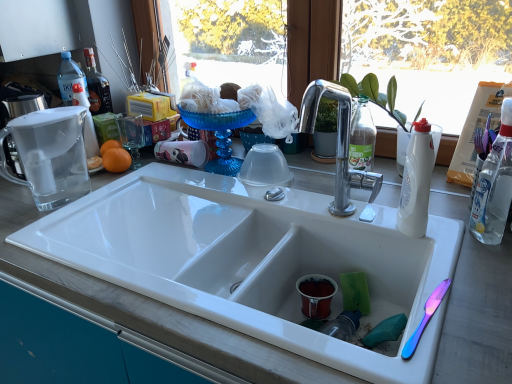
What is the approximate height of orangesmoothfruit at left?

3.16 inches.

You are a GUI agent. You are given a task and a screenshot of the screen. Output one action in this format:
    pyautogui.click(x=<x>, y=<y>)
    Task: Click on the green sponge at sink bottom
    
    Given the screenshot: What is the action you would take?
    pyautogui.click(x=355, y=292)

At what (x,y) coordinates should I click in order to perform the action: click on clear plastic bottle at upper left, arranged as the 3th bottle when viewed from the right. Please return your answer as a coordinate pair (x, y). Looking at the image, I should click on (77, 98).

Describe the element at coordinates (254, 260) in the screenshot. I see `white ceramic sink at center` at that location.

What do you see at coordinates (183, 152) in the screenshot?
I see `matte white coffee cup at center, marked as the second coffee cup in a right-to-left arrangement` at bounding box center [183, 152].

At what (x,y) coordinates should I click in order to perform the action: click on matte ceramic cup at sink bottom, which is counted as the second coffee cup, starting from the top. Please return your answer as a coordinate pair (x, y). Looking at the image, I should click on (316, 295).

Locate an element on the screen. clear glass pitcher at upper left is located at coordinates (50, 155).

Measure the distance between point [80,167] and camera.

A distance of 3.74 feet exists between point [80,167] and camera.

At what (x,y) coordinates should I click in order to perform the action: click on white plastic bottle at right, which appears as the 2th bottle when viewed from the back. Please return your answer as a coordinate pair (x, y). Looking at the image, I should click on (416, 181).

Is white plastic bottle at right, which is counted as the second bottle, starting from the left, turned away from white plastic bottle at right, the first bottle in the right-to-left sequence?

No, white plastic bottle at right, the first bottle in the right-to-left sequence, is not at the back of white plastic bottle at right, which is counted as the second bottle, starting from the left.

From the image's perspective, is white plastic bottle at right, acting as the 2th bottle starting from the front, located beneath white plastic bottle at right, the first bottle in the right-to-left sequence?

Correct, white plastic bottle at right, acting as the 2th bottle starting from the front, appears lower than white plastic bottle at right, the first bottle in the right-to-left sequence, in the image.

Can you confirm if white plastic bottle at right, which appears as the 2th bottle when viewed from the back, is positioned to the right of white plastic bottle at right, the 3th bottle in the back-to-front sequence?

No.

From a real-world perspective, who is located lower, white plastic bottle at right, which is counted as the second bottle, starting from the left, or white plastic bottle at right, the first bottle in the front-to-back sequence?

white plastic bottle at right, which is counted as the second bottle, starting from the left.

What are the coordinates of `the 2nd coffee cup directly above the green sponge at sink bottom (from a real-world perspective)` in the screenshot? It's located at (183, 152).

Can you see green sponge at sink bottom touching matte white coffee cup at center, acting as the 2th coffee cup starting from the bottom?

No, green sponge at sink bottom is not beside matte white coffee cup at center, acting as the 2th coffee cup starting from the bottom.

Is green sponge at sink bottom positioned beyond the bounds of matte white coffee cup at center, acting as the 2th coffee cup starting from the bottom?

Yes, green sponge at sink bottom is located beyond the bounds of matte white coffee cup at center, acting as the 2th coffee cup starting from the bottom.

Considering the sizes of objects green sponge at sink bottom and matte white coffee cup at center, acting as the 2th coffee cup starting from the bottom, in the image provided, who is taller, green sponge at sink bottom or matte white coffee cup at center, acting as the 2th coffee cup starting from the bottom,?

Standing taller between the two is matte white coffee cup at center, acting as the 2th coffee cup starting from the bottom.

Which object is positioned more to the left, matte ceramic cup at sink bottom, which appears as the 1th coffee cup when viewed from the right, or matte white coffee cup at center, placed as the 1th coffee cup when sorted from top to bottom?

Positioned to the left is matte white coffee cup at center, placed as the 1th coffee cup when sorted from top to bottom.

Can you confirm if matte ceramic cup at sink bottom, which is the 1th coffee cup from bottom to top, is taller than matte white coffee cup at center, the first coffee cup in the back-to-front sequence?

Incorrect, the height of matte ceramic cup at sink bottom, which is the 1th coffee cup from bottom to top, is not larger of that of matte white coffee cup at center, the first coffee cup in the back-to-front sequence.

Based on the photo, is matte ceramic cup at sink bottom, which is the 1th coffee cup from bottom to top, not close to matte white coffee cup at center, the first coffee cup in the back-to-front sequence?

matte ceramic cup at sink bottom, which is the 1th coffee cup from bottom to top, is actually quite close to matte white coffee cup at center, the first coffee cup in the back-to-front sequence.

Are white plastic bottle at right, the first bottle in the front-to-back sequence, and green sponge at sink bottom beside each other?

white plastic bottle at right, the first bottle in the front-to-back sequence, and green sponge at sink bottom are clearly separated.

Considering the sizes of objects white plastic bottle at right, the 3th bottle in the back-to-front sequence, and green sponge at sink bottom in the image provided, who is bigger, white plastic bottle at right, the 3th bottle in the back-to-front sequence, or green sponge at sink bottom?

white plastic bottle at right, the 3th bottle in the back-to-front sequence.

Between white plastic bottle at right, which is the 3th bottle from left to right, and green sponge at sink bottom, which one appears on the left side from the viewer's perspective?

Positioned to the left is green sponge at sink bottom.

Looking at their sizes, would you say white plastic bottle at right, the 3th bottle in the back-to-front sequence, is wider or thinner than green sponge at sink bottom?

white plastic bottle at right, the 3th bottle in the back-to-front sequence, is wider than green sponge at sink bottom.

The image size is (512, 384). I want to click on the 1st bottle below when counting from the clear glass pitcher at upper left (from the image's perspective), so click(x=494, y=185).

From the image's perspective, between white plastic bottle at right, which is the 3th bottle from left to right, and clear glass pitcher at upper left, which one is located above?

clear glass pitcher at upper left, from the image's perspective.

From a real-world perspective, is white plastic bottle at right, which is the 3th bottle from left to right, positioned under clear glass pitcher at upper left based on gravity?

Incorrect, from a real-world perspective, white plastic bottle at right, which is the 3th bottle from left to right, is higher than clear glass pitcher at upper left.

Can you confirm if white plastic bottle at right, which is the 3th bottle from left to right, is positioned to the right of clear glass pitcher at upper left?

Yes, white plastic bottle at right, which is the 3th bottle from left to right, is to the right of clear glass pitcher at upper left.

Can you confirm if green sponge at sink bottom is wider than white plastic bottle at right, which is the 3th bottle from left to right?

In fact, green sponge at sink bottom might be narrower than white plastic bottle at right, which is the 3th bottle from left to right.

Does green sponge at sink bottom appear on the left side of white plastic bottle at right, the 3th bottle in the back-to-front sequence?

Indeed, green sponge at sink bottom is positioned on the left side of white plastic bottle at right, the 3th bottle in the back-to-front sequence.

Is green sponge at sink bottom positioned far away from white plastic bottle at right, the first bottle in the right-to-left sequence?

They are positioned close to each other.

Considering the relative sizes of green sponge at sink bottom and white plastic bottle at right, the first bottle in the right-to-left sequence, in the image provided, is green sponge at sink bottom smaller than white plastic bottle at right, the first bottle in the right-to-left sequence,?

Correct, green sponge at sink bottom occupies less space than white plastic bottle at right, the first bottle in the right-to-left sequence.

Which object is positioned more to the right, white ceramic sink at center or clear plastic bottle at upper left, the 1th bottle positioned from the back?

white ceramic sink at center is more to the right.

Is white ceramic sink at center oriented away from clear plastic bottle at upper left, which is the first bottle in left-to-right order?

No, white ceramic sink at center's orientation is not away from clear plastic bottle at upper left, which is the first bottle in left-to-right order.

Who is smaller, white ceramic sink at center or clear plastic bottle at upper left, arranged as the 3th bottle when viewed from the right?

Smaller between the two is clear plastic bottle at upper left, arranged as the 3th bottle when viewed from the right.

Identify the location of bottle that is the 1st object located behind the white plastic bottle at right, the 3th bottle in the back-to-front sequence. Image resolution: width=512 pixels, height=384 pixels. (416, 181).

From a real-world perspective, which coffee cup is the 2nd one above the green sponge at sink bottom? Please provide its 2D coordinates.

[(183, 152)]

From the picture: Considering their positions, is green sponge at sink bottom positioned further to matte white coffee cup at center, placed as the 1th coffee cup when sorted from top to bottom, than white plastic bottle at right, the first bottle in the right-to-left sequence?

white plastic bottle at right, the first bottle in the right-to-left sequence, lies further to matte white coffee cup at center, placed as the 1th coffee cup when sorted from top to bottom, than the other object.

Based on their spatial positions, is white ceramic sink at center or clear glass pitcher at upper left closer to matte white coffee cup at center, acting as the 2th coffee cup starting from the bottom?

Based on the image, clear glass pitcher at upper left appears to be nearer to matte white coffee cup at center, acting as the 2th coffee cup starting from the bottom.

Estimate the real-world distances between objects in this image. Which object is closer to orangesmoothfruit at left, white plastic bottle at right, the second bottle when ordered from right to left, or green sponge at sink bottom?

The object closer to orangesmoothfruit at left is green sponge at sink bottom.

Which object lies nearer to the anchor point clear plastic bottle at upper left, the 1th bottle positioned from the back, matte ceramic cup at sink bottom, arranged as the second coffee cup when viewed from the left, or white ceramic sink at center?

white ceramic sink at center.

Estimate the real-world distances between objects in this image. Which object is closer to white plastic bottle at right, the 3th bottle in the back-to-front sequence, orangesmoothfruit at left or clear plastic bottle at upper left, the 1th bottle positioned from the back?

orangesmoothfruit at left lies closer to white plastic bottle at right, the 3th bottle in the back-to-front sequence, than the other object.

Which object lies further to the anchor point white plastic bottle at right, the 3th bottle in the back-to-front sequence, matte ceramic cup at sink bottom, which appears as the 1th coffee cup when viewed from the right, or white plastic bottle at right, which is counted as the second bottle, starting from the left?

matte ceramic cup at sink bottom, which appears as the 1th coffee cup when viewed from the right.

Which object lies further to the anchor point matte white coffee cup at center, placed as the 1th coffee cup when sorted from top to bottom, matte ceramic cup at sink bottom, which is the 1th coffee cup from bottom to top, or clear plastic bottle at upper left, which is the first bottle in left-to-right order?

Among the two, matte ceramic cup at sink bottom, which is the 1th coffee cup from bottom to top, is located further to matte white coffee cup at center, placed as the 1th coffee cup when sorted from top to bottom.

Looking at the image, which one is located closer to clear glass pitcher at upper left, clear plastic bottle at upper left, placed as the 3th bottle when sorted from front to back, or matte white coffee cup at center, acting as the 2th coffee cup starting from the bottom?

clear plastic bottle at upper left, placed as the 3th bottle when sorted from front to back.

Find the location of a particular element. orange situated between clear plastic bottle at upper left, placed as the 3th bottle when sorted from front to back, and white plastic bottle at right, the second bottle when ordered from right to left, from left to right is located at coordinates (116, 160).

This screenshot has width=512, height=384. In order to click on appliance situated between clear plastic bottle at upper left, placed as the 3th bottle when sorted from front to back, and white plastic bottle at right, which appears as the 2th bottle when viewed from the back, from left to right in this screenshot , I will do `click(50, 155)`.

The width and height of the screenshot is (512, 384). In order to click on coffee cup between matte white coffee cup at center, marked as the second coffee cup in a right-to-left arrangement, and green sponge at sink bottom from left to right in this screenshot , I will do `click(316, 295)`.

This screenshot has height=384, width=512. I want to click on appliance between white ceramic sink at center and clear plastic bottle at upper left, arranged as the 3th bottle when viewed from the right, along the z-axis, so click(50, 155).